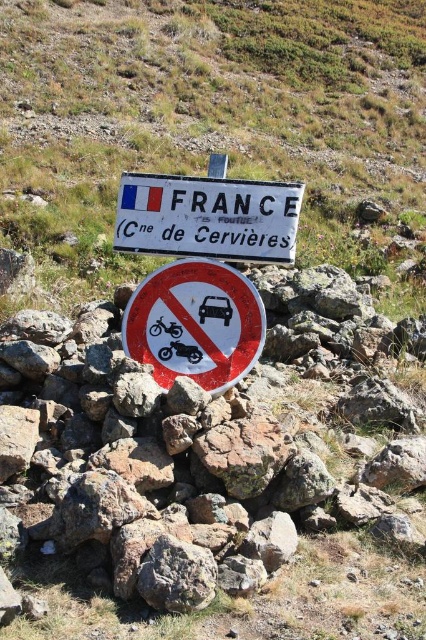
You are a hiker who wants to read both the white plastic sign at center and the metallic reflective sign at center. Which one should you look at first if you want to read them in the order they appear from top to bottom?

You should look at the white plastic sign at center first because it is located above the metallic reflective sign at center.

You are a hiker standing at the base of the rock pile and want to touch the white plastic sign at center and the white plastic sign at upper center. Which one can you reach first without moving your position?

The white plastic sign at center is closer to the viewer than the white plastic sign at upper center, so you can reach the white plastic sign at center first without moving your position.